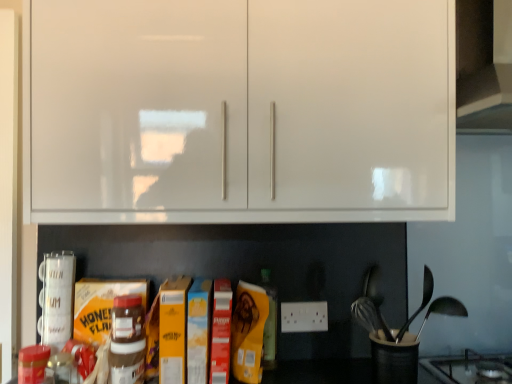
Question: From a real-world perspective, is matte brown plastic nutella jar at center, the first bottle in the front-to-back sequence, over black plastic utensil holder at lower right?

Choices:
 (A) yes
 (B) no

Answer: (A)

Question: Considering the relative sizes of matte brown plastic nutella jar at center, marked as the second bottle in a back-to-front arrangement, and black plastic utensil holder at lower right in the image provided, is matte brown plastic nutella jar at center, marked as the second bottle in a back-to-front arrangement, wider than black plastic utensil holder at lower right?

Choices:
 (A) no
 (B) yes

Answer: (A)

Question: Are matte brown plastic nutella jar at center, the first bottle in the front-to-back sequence, and black plastic utensil holder at lower right far apart?

Choices:
 (A) yes
 (B) no

Answer: (B)

Question: Could you tell me if matte brown plastic nutella jar at center, the second bottle positioned from the right, is facing black plastic utensil holder at lower right?

Choices:
 (A) yes
 (B) no

Answer: (B)

Question: Considering the relative sizes of matte brown plastic nutella jar at center, the first bottle in the front-to-back sequence, and black plastic utensil holder at lower right in the image provided, is matte brown plastic nutella jar at center, the first bottle in the front-to-back sequence, bigger than black plastic utensil holder at lower right?

Choices:
 (A) yes
 (B) no

Answer: (B)

Question: Is point (270, 347) closer or farther from the camera than point (404, 23)?

Choices:
 (A) closer
 (B) farther

Answer: (B)

Question: Visually, is matte brown bottle at center, arranged as the 1th bottle when viewed from the back, positioned to the left or to the right of white glossy cabinet at upper center?

Choices:
 (A) right
 (B) left

Answer: (A)

Question: Is matte brown bottle at center, which ranks as the first bottle in right-to-left order, wider or thinner than white glossy cabinet at upper center?

Choices:
 (A) wide
 (B) thin

Answer: (B)

Question: Considering the positions of matte brown bottle at center, placed as the second bottle when sorted from left to right, and white glossy cabinet at upper center in the image, is matte brown bottle at center, placed as the second bottle when sorted from left to right, taller or shorter than white glossy cabinet at upper center?

Choices:
 (A) tall
 (B) short

Answer: (B)

Question: In terms of width, does satin silver spoon at right look wider or thinner when compared to matte brown plastic nutella jar at center, the first bottle in the front-to-back sequence?

Choices:
 (A) thin
 (B) wide

Answer: (A)

Question: Is point (419, 307) closer or farther from the camera than point (110, 349)?

Choices:
 (A) closer
 (B) farther

Answer: (B)

Question: From the image's perspective, is satin silver spoon at right located above or below matte brown plastic nutella jar at center, acting as the 1th bottle starting from the left?

Choices:
 (A) below
 (B) above

Answer: (B)

Question: Is satin silver spoon at right inside or outside of matte brown plastic nutella jar at center, the second bottle positioned from the right?

Choices:
 (A) inside
 (B) outside

Answer: (B)

Question: From the image's perspective, relative to white glossy cabinet at upper center, is matte brown plastic nutella jar at center, acting as the 1th bottle starting from the left, above or below?

Choices:
 (A) above
 (B) below

Answer: (B)

Question: Is matte brown plastic nutella jar at center, the second bottle positioned from the right, wider or thinner than white glossy cabinet at upper center?

Choices:
 (A) thin
 (B) wide

Answer: (A)